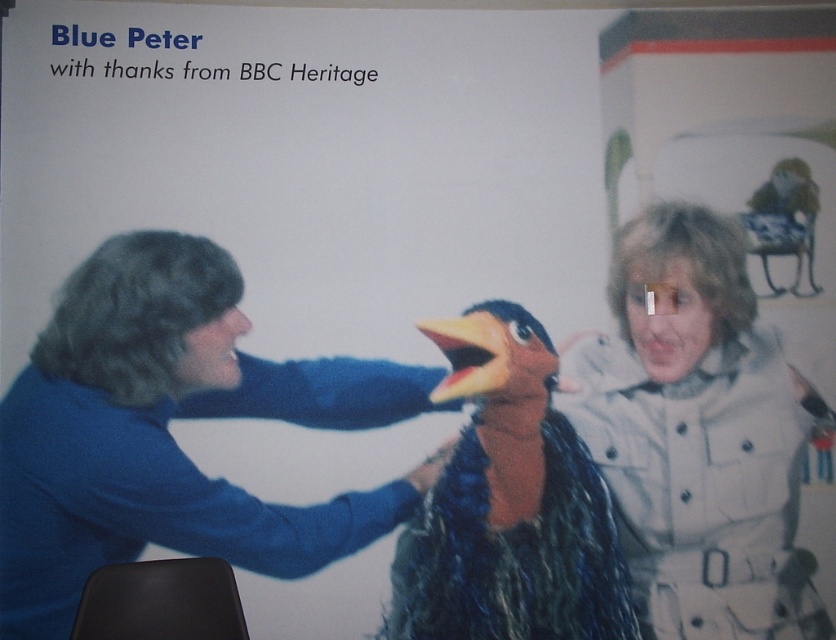
Who is more distant from viewer, (702, 442) or (492, 554)?

The point (702, 442) is more distant.

Is point (740, 244) in front of point (456, 620)?

No, (740, 244) is further to viewer.

Identify the location of light beige textured coat at right. This screenshot has height=640, width=836. (699, 435).

I want to click on light beige textured coat at right, so click(x=699, y=435).

Between point (136, 234) and point (503, 404), which one is positioned behind?

The point (503, 404) is behind.

Can you confirm if blue velvet sweater at left is positioned above fuzzy brown penguin at center?

Yes, blue velvet sweater at left is above fuzzy brown penguin at center.

Which is behind, point (78, 340) or point (599, 529)?

The point (599, 529) is behind.

The width and height of the screenshot is (836, 640). Find the location of `blue velvet sweater at left`. blue velvet sweater at left is located at coordinates (167, 433).

Is blue velvet sweater at left closer to camera compared to light beige textured coat at right?

Yes, blue velvet sweater at left is in front of light beige textured coat at right.

Which is behind, point (128, 483) or point (676, 481)?

Point (676, 481)

Measure the distance between blue velvet sweater at left and camera.

blue velvet sweater at left is 10.47 feet away from camera.

The height and width of the screenshot is (640, 836). Find the location of `blue velvet sweater at left`. blue velvet sweater at left is located at coordinates (167, 433).